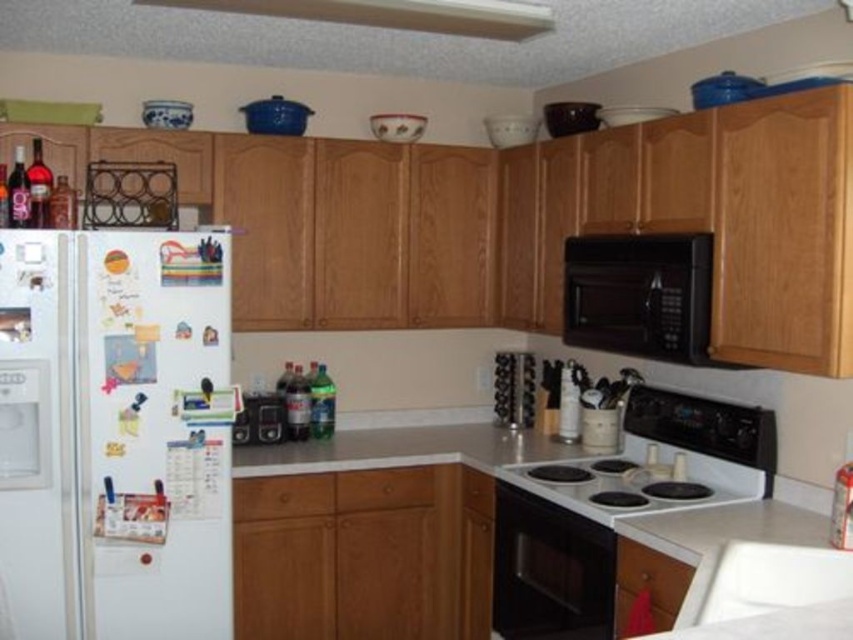
Question: Can you confirm if white matte refrigerator at left is positioned above brushed metal toaster at left?

Choices:
 (A) yes
 (B) no

Answer: (B)

Question: Which of the following is the farthest from the observer?

Choices:
 (A) (271, 406)
 (B) (463, 424)

Answer: (B)

Question: Does black matte microwave at upper center have a smaller size compared to white glossy electric stove at center?

Choices:
 (A) no
 (B) yes

Answer: (A)

Question: Does white matte refrigerator at left have a lesser width compared to black matte microwave at upper center?

Choices:
 (A) no
 (B) yes

Answer: (A)

Question: Which object is closer to the camera taking this photo?

Choices:
 (A) white matte exhaust hood at upper center
 (B) white ceramic sink at lower right
 (C) black matte microwave at upper center

Answer: (B)

Question: Which of these objects is positioned farthest from the white ceramic sink at lower right?

Choices:
 (A) brushed metal toaster at left
 (B) white glossy electric stove at center

Answer: (A)